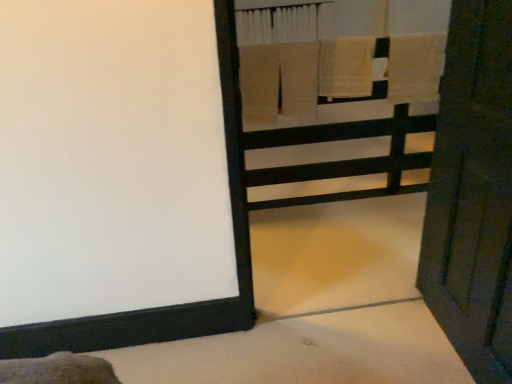
Question: Does wooden door at right have a lesser height compared to wooden bunk bed at upper right?

Choices:
 (A) yes
 (B) no

Answer: (A)

Question: Is wooden door at right to the left of wooden bunk bed at upper right from the viewer's perspective?

Choices:
 (A) no
 (B) yes

Answer: (A)

Question: Is wooden door at right taller than wooden bunk bed at upper right?

Choices:
 (A) yes
 (B) no

Answer: (B)

Question: Is wooden door at right not near wooden bunk bed at upper right?

Choices:
 (A) no
 (B) yes

Answer: (B)

Question: Can you confirm if wooden door at right is smaller than wooden bunk bed at upper right?

Choices:
 (A) no
 (B) yes

Answer: (B)

Question: From a real-world perspective, does wooden door at right sit lower than wooden bunk bed at upper right?

Choices:
 (A) no
 (B) yes

Answer: (B)

Question: From a real-world perspective, is beige cotton towel at upper center, which is the second bath towel in right-to-left order, on beige cotton towel at upper right, the 1th bath towel in the right-to-left sequence?

Choices:
 (A) no
 (B) yes

Answer: (A)

Question: Does beige cotton towel at upper center, which ranks as the first bath towel in left-to-right order, appear on the right side of beige cotton towel at upper right, the 2th bath towel positioned from the left?

Choices:
 (A) yes
 (B) no

Answer: (B)

Question: Considering the relative sizes of beige cotton towel at upper center, which is the second bath towel in right-to-left order, and beige cotton towel at upper right, the 1th bath towel in the right-to-left sequence, in the image provided, is beige cotton towel at upper center, which is the second bath towel in right-to-left order, thinner than beige cotton towel at upper right, the 1th bath towel in the right-to-left sequence,?

Choices:
 (A) yes
 (B) no

Answer: (B)

Question: Considering the relative sizes of beige cotton towel at upper center, which is the second bath towel in right-to-left order, and beige cotton towel at upper right, the 1th bath towel in the right-to-left sequence, in the image provided, is beige cotton towel at upper center, which is the second bath towel in right-to-left order, shorter than beige cotton towel at upper right, the 1th bath towel in the right-to-left sequence,?

Choices:
 (A) no
 (B) yes

Answer: (A)

Question: Is beige cotton towel at upper center, which is the second bath towel in right-to-left order, further to camera compared to beige cotton towel at upper right, the 1th bath towel in the right-to-left sequence?

Choices:
 (A) no
 (B) yes

Answer: (A)

Question: Is beige cotton towel at upper center, which is the second bath towel in right-to-left order, taller than beige cotton towel at upper right, the 2th bath towel positioned from the left?

Choices:
 (A) no
 (B) yes

Answer: (B)

Question: Can you see beige cotton towel at upper right, the 1th bath towel in the right-to-left sequence, touching beige cotton towel at upper center, which is the second bath towel in right-to-left order?

Choices:
 (A) no
 (B) yes

Answer: (A)